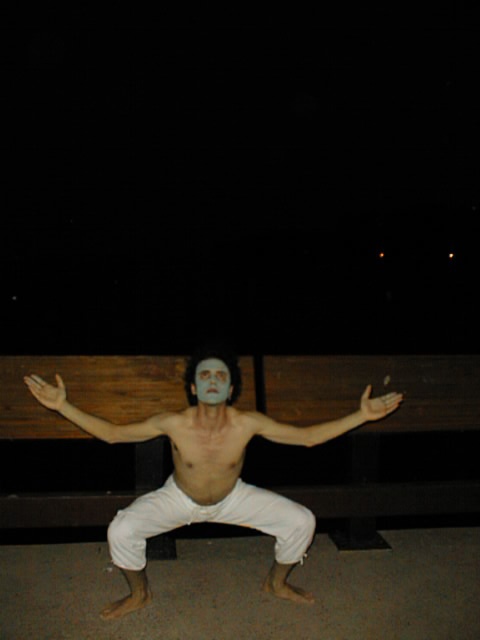
Question: Is matte white arm at center positioned in front of smooth matte face at center?

Choices:
 (A) no
 (B) yes

Answer: (A)

Question: Which point appears farthest from the camera in this image?

Choices:
 (A) (245, 417)
 (B) (115, 440)

Answer: (B)

Question: Is matte white arm at center in front of pale skin/soft flesh at center?

Choices:
 (A) yes
 (B) no

Answer: (B)

Question: Does matte white arm at center have a greater width compared to pale skin/soft flesh at center?

Choices:
 (A) no
 (B) yes

Answer: (B)

Question: Which of the following is the closest to the observer?

Choices:
 (A) smooth matte face at center
 (B) smooth skin torso at center
 (C) matte white arm at center

Answer: (A)

Question: Which of the following is the closest to the observer?

Choices:
 (A) (x=36, y=381)
 (B) (x=292, y=442)

Answer: (A)